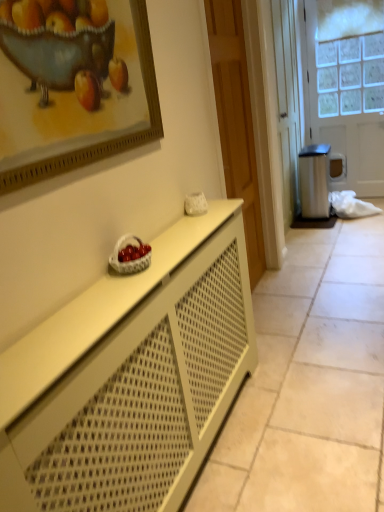
Describe the element at coordinates (132, 259) in the screenshot. I see `white wicker basket at center` at that location.

Describe the element at coordinates (74, 94) in the screenshot. The image size is (384, 512). I see `wooden framed painting at upper left` at that location.

The image size is (384, 512). What do you see at coordinates (236, 122) in the screenshot?
I see `wooden door at center, which is the 1th door from front to back` at bounding box center [236, 122].

What do you see at coordinates (346, 89) in the screenshot? The width and height of the screenshot is (384, 512). I see `white frosted glass door at right, which is the 2th door from front to back` at bounding box center [346, 89].

Where is `white wicker basket at center`? white wicker basket at center is located at coordinates (132, 259).

Is white matte cabinet at center taller or shorter than white frosted glass door at right, the 1th door viewed from the right?

In the image, white matte cabinet at center appears to be shorter than white frosted glass door at right, the 1th door viewed from the right.

From the image's perspective, who appears lower, white matte cabinet at center or white frosted glass door at right, which is counted as the first door, starting from the back?

white matte cabinet at center is shown below in the image.

Which object is positioned more to the left, white matte cabinet at center or white frosted glass door at right, the 1th door viewed from the right?

white matte cabinet at center.

In terms of height, does wooden door at center, which is the 1th door from front to back, look taller or shorter compared to wooden framed painting at upper left?

In the image, wooden door at center, which is the 1th door from front to back, appears to be taller than wooden framed painting at upper left.

Is wooden door at center, acting as the first door starting from the left, located outside wooden framed painting at upper left?

Yes.

Based on the photo, considering the positions of objects wooden door at center, marked as the second door in a back-to-front arrangement, and wooden framed painting at upper left in the image provided, who is more to the left, wooden door at center, marked as the second door in a back-to-front arrangement, or wooden framed painting at upper left?

From the viewer's perspective, wooden framed painting at upper left appears more on the left side.

Is wooden door at center, marked as the second door in a back-to-front arrangement, not near wooden framed painting at upper left?

Yes.

Could white wicker basket at center be considered to be inside white matte cabinet at center?

Definitely not — white wicker basket at center is not inside white matte cabinet at center.

Looking at this image, from a real-world perspective, does white matte cabinet at center stand above white wicker basket at center?

Incorrect, from a real-world perspective, white matte cabinet at center is lower than white wicker basket at center.

The width and height of the screenshot is (384, 512). Find the location of `cabinetry that is in front of the white wicker basket at center`. cabinetry that is in front of the white wicker basket at center is located at coordinates (131, 378).

How many degrees apart are the facing directions of wooden framed painting at upper left and white frosted glass door at right, which is counted as the first door, starting from the back?

The angle between the facing direction of wooden framed painting at upper left and the facing direction of white frosted glass door at right, which is counted as the first door, starting from the back, is 91.7 degrees.

Is wooden framed painting at upper left not inside white frosted glass door at right, positioned as the 2th door in left-to-right order?

Indeed, wooden framed painting at upper left is completely outside white frosted glass door at right, positioned as the 2th door in left-to-right order.

In the scene shown: Is wooden framed painting at upper left touching white frosted glass door at right, which is counted as the first door, starting from the back?

wooden framed painting at upper left and white frosted glass door at right, which is counted as the first door, starting from the back, are not in contact.

Is point (140, 144) closer to viewer compared to point (372, 23)?

That is True.

Could white wicker basket at center be considered to be inside white frosted glass door at right, which is counted as the first door, starting from the back?

No, white wicker basket at center is not surrounded by white frosted glass door at right, which is counted as the first door, starting from the back.

Where is `fruit dish directly beneath the white frosted glass door at right, positioned as the 2th door in left-to-right order (from a real-world perspective)`? fruit dish directly beneath the white frosted glass door at right, positioned as the 2th door in left-to-right order (from a real-world perspective) is located at coordinates (132, 259).

Is white frosted glass door at right, which is counted as the first door, starting from the back, next to white wicker basket at center?

white frosted glass door at right, which is counted as the first door, starting from the back, and white wicker basket at center are clearly separated.

Image resolution: width=384 pixels, height=512 pixels. In order to click on cabinetry that is on the left side of wooden door at center, acting as the first door starting from the left in this screenshot , I will do `click(131, 378)`.

Considering the sizes of objects white matte cabinet at center and wooden door at center, the second door in the right-to-left sequence, in the image provided, who is thinner, white matte cabinet at center or wooden door at center, the second door in the right-to-left sequence,?

wooden door at center, the second door in the right-to-left sequence, is thinner.

Can you confirm if white matte cabinet at center is positioned to the left of wooden door at center, which is the 1th door from front to back?

Indeed, white matte cabinet at center is positioned on the left side of wooden door at center, which is the 1th door from front to back.

Relative to wooden door at center, the second door in the right-to-left sequence, is white matte cabinet at center in front or behind?

white matte cabinet at center is positioned closer to the viewer than wooden door at center, the second door in the right-to-left sequence.

Between point (220, 77) and point (139, 244), which one is positioned behind?

The point (220, 77) is behind.

Considering the relative positions of wooden door at center, the second door in the right-to-left sequence, and white wicker basket at center in the image provided, is wooden door at center, the second door in the right-to-left sequence, to the right of white wicker basket at center from the viewer's perspective?

Yes, wooden door at center, the second door in the right-to-left sequence, is to the right of white wicker basket at center.

In the image, is wooden door at center, which is the 1th door from front to back, positioned in front of or behind white wicker basket at center?

wooden door at center, which is the 1th door from front to back, is positioned farther from the viewer than white wicker basket at center.

What are the coordinates of `the 2nd door above when counting from the white matte cabinet at center (from the image's perspective)` in the screenshot? It's located at (346, 89).

This screenshot has width=384, height=512. I want to click on picture frame above the wooden door at center, acting as the first door starting from the left (from a real-world perspective), so click(x=74, y=94).

In the scene shown: When comparing their distances from wooden framed painting at upper left, does white matte cabinet at center or wooden door at center, the second door in the right-to-left sequence, seem closer?

white matte cabinet at center is positioned closer to the anchor wooden framed painting at upper left.

Estimate the real-world distances between objects in this image. Which object is closer to wooden door at center, marked as the second door in a back-to-front arrangement, white matte cabinet at center or white wicker basket at center?

Among the two, white matte cabinet at center is located nearer to wooden door at center, marked as the second door in a back-to-front arrangement.

From the image, which object appears to be farther from white matte cabinet at center, wooden door at center, which is the 1th door from front to back, or wooden framed painting at upper left?

The object further to white matte cabinet at center is wooden door at center, which is the 1th door from front to back.

Considering their positions, is white wicker basket at center positioned further to wooden door at center, acting as the first door starting from the left, than white frosted glass door at right, positioned as the 2th door in left-to-right order?

Among the two, white frosted glass door at right, positioned as the 2th door in left-to-right order, is located further to wooden door at center, acting as the first door starting from the left.

Considering their positions, is wooden door at center, acting as the first door starting from the left, positioned closer to wooden framed painting at upper left than white frosted glass door at right, positioned as the 2th door in left-to-right order?

The object closer to wooden framed painting at upper left is wooden door at center, acting as the first door starting from the left.

Based on their spatial positions, is white wicker basket at center or white matte cabinet at center closer to wooden framed painting at upper left?

Among the two, white wicker basket at center is located nearer to wooden framed painting at upper left.

When comparing their distances from white frosted glass door at right, the 1th door viewed from the right, does white wicker basket at center or wooden framed painting at upper left seem further?

The object further to white frosted glass door at right, the 1th door viewed from the right, is white wicker basket at center.

From the image, which object appears to be nearer to white matte cabinet at center, wooden door at center, the second door in the right-to-left sequence, or white frosted glass door at right, the 1th door viewed from the right?

The object closer to white matte cabinet at center is wooden door at center, the second door in the right-to-left sequence.

Find the location of `picture frame between white matte cabinet at center and white frosted glass door at right, positioned as the 2th door in left-to-right order, in the front-back direction`. picture frame between white matte cabinet at center and white frosted glass door at right, positioned as the 2th door in left-to-right order, in the front-back direction is located at coordinates (74, 94).

This screenshot has height=512, width=384. Identify the location of fruit dish between white matte cabinet at center and white frosted glass door at right, which is the 2th door from front to back, along the z-axis. (132, 259).

Identify the location of picture frame between white matte cabinet at center and wooden door at center, which is the 1th door from front to back, in the front-back direction. The height and width of the screenshot is (512, 384). (74, 94).

The image size is (384, 512). I want to click on door positioned between white matte cabinet at center and white frosted glass door at right, the 1th door viewed from the right, from near to far, so click(236, 122).